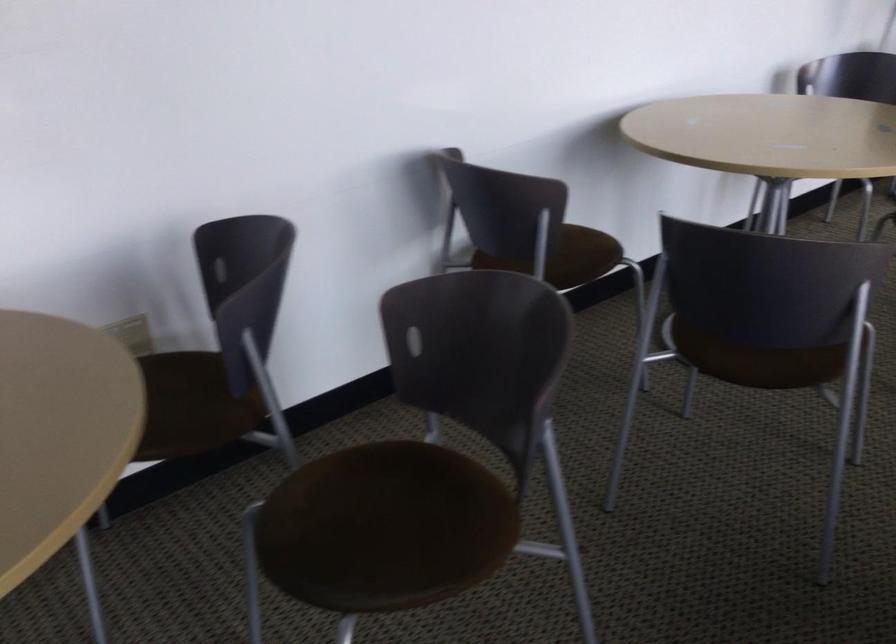
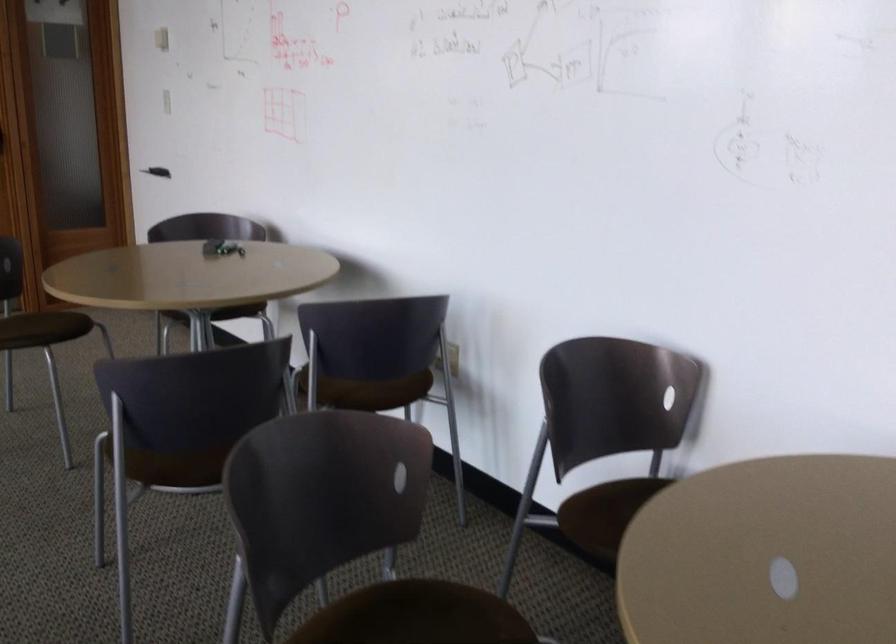
In the second image, find the point that corresponds to point (547, 269) in the first image.

(595, 514)